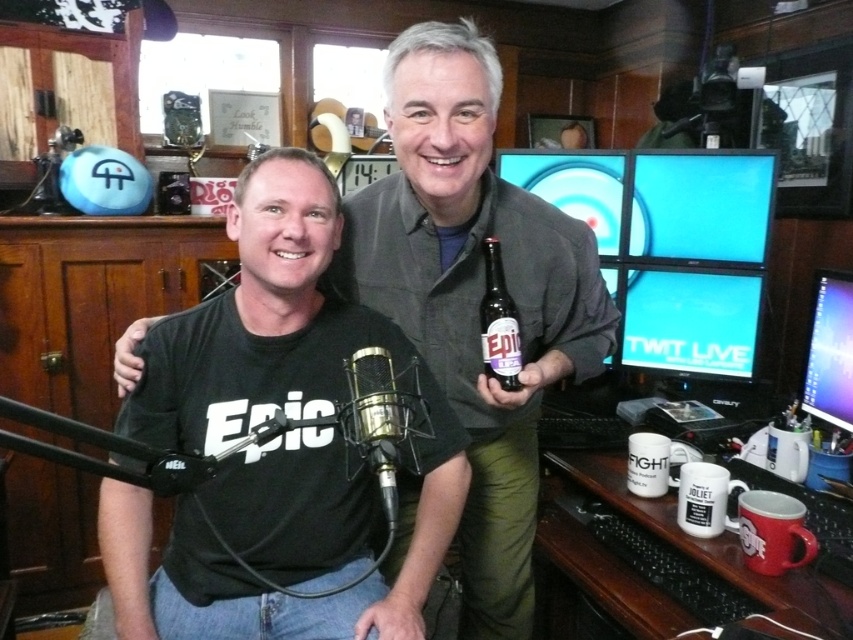
Based on the photo, between black metallic microphone at center and glossy plastic monitor at upper right, which one appears on the right side from the viewer's perspective?

Positioned to the right is glossy plastic monitor at upper right.

Can you confirm if black metallic microphone at center is taller than glossy plastic monitor at upper right?

Incorrect, black metallic microphone at center's height is not larger of glossy plastic monitor at upper right's.

Does point (350, 397) come closer to viewer compared to point (839, 307)?

Yes, it is in front of point (839, 307).

What are the coordinates of `black metallic microphone at center` in the screenshot? It's located at pyautogui.click(x=375, y=420).

From the picture: How far apart are black matte t-shirt at center and glossy plastic monitor at upper right?

black matte t-shirt at center is 98.04 centimeters from glossy plastic monitor at upper right.

What do you see at coordinates (264, 314) in the screenshot? I see `black matte t-shirt at center` at bounding box center [264, 314].

In order to click on black matte t-shirt at center in this screenshot , I will do `click(264, 314)`.

The image size is (853, 640). What are the coordinates of `black matte t-shirt at center` in the screenshot? It's located at (264, 314).

Which is in front, point (727, 305) or point (379, 435)?

Point (379, 435)

Is matte black monitor at center right taller than black metallic microphone at center?

Indeed, matte black monitor at center right has a greater height compared to black metallic microphone at center.

Is point (753, 376) positioned in front of point (392, 481)?

No, (753, 376) is further to viewer.

Identify the location of matte black monitor at center right. Image resolution: width=853 pixels, height=640 pixels. (689, 321).